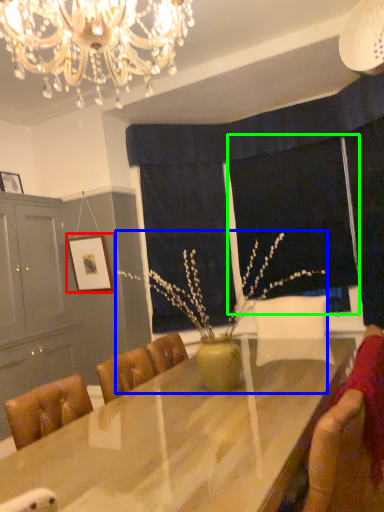
Question: Which object is the closest to the picture frame (highlighted by a red box)? Choose among these: floral arrangement (highlighted by a blue box) or window screen (highlighted by a green box).

Choices:
 (A) floral arrangement
 (B) window screen

Answer: (A)